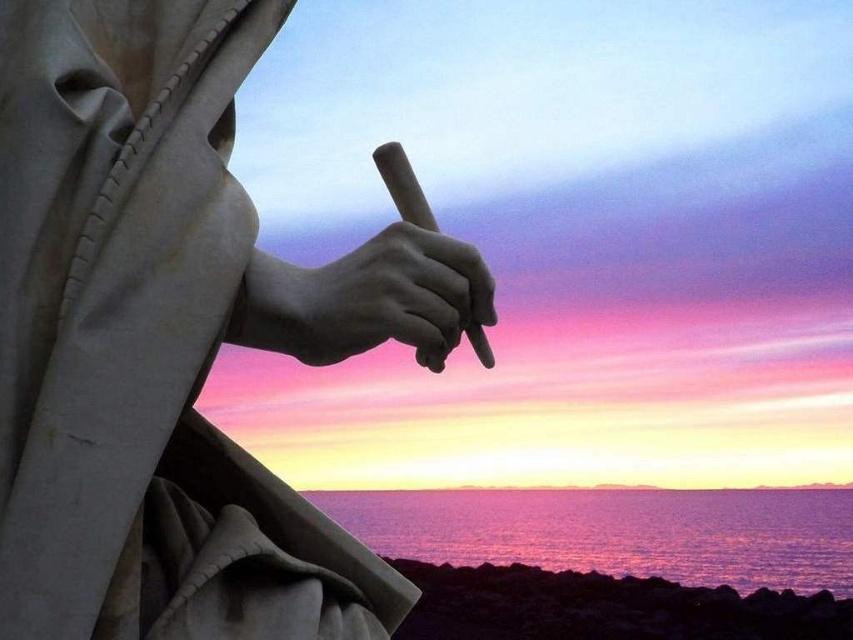
Question: Does white marble hand at center appear over matte stone hand at center?

Choices:
 (A) no
 (B) yes

Answer: (B)

Question: Which point is closer to the camera?

Choices:
 (A) 403,545
 (B) 347,256

Answer: (B)

Question: Which point appears closest to the camera in this image?

Choices:
 (A) (184, 243)
 (B) (590, 508)
 (C) (355, 291)

Answer: (A)

Question: Can you confirm if white marble hand at center is positioned above matte stone hand at center?

Choices:
 (A) no
 (B) yes

Answer: (B)

Question: Which of the following is the farthest from the observer?

Choices:
 (A) purple reflective water at lower center
 (B) matte stone hand at center

Answer: (A)

Question: Is white marble hand at center to the left of purple reflective water at lower center from the viewer's perspective?

Choices:
 (A) yes
 (B) no

Answer: (B)